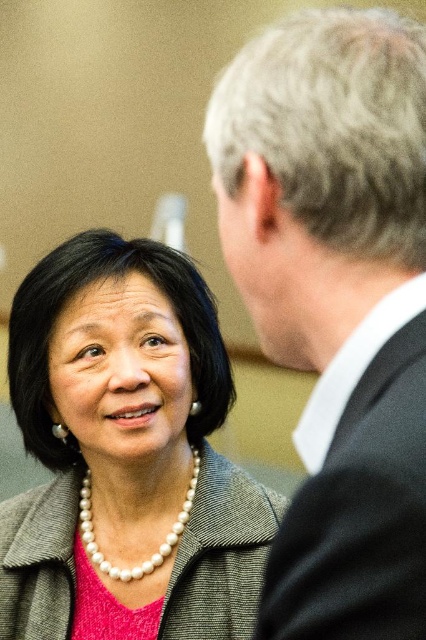
Question: Does black wool suit at upper right appear under gray textured jacket at center?

Choices:
 (A) yes
 (B) no

Answer: (B)

Question: Can you confirm if smooth gray suit at right is positioned to the left of pearl necklace at center?

Choices:
 (A) no
 (B) yes

Answer: (A)

Question: Which object is closer to the camera taking this photo?

Choices:
 (A) smooth gray suit at right
 (B) gray textured jacket at center
 (C) black wool suit at upper right
 (D) pearl necklace at center

Answer: (A)

Question: Which object appears closest to the camera in this image?

Choices:
 (A) black wool suit at upper right
 (B) smooth gray suit at right
 (C) gray textured jacket at center
 (D) pearl necklace at center

Answer: (B)

Question: Which point is farther from the camera taking this photo?

Choices:
 (A) (252, 60)
 (B) (210, 464)

Answer: (B)

Question: Can you confirm if smooth gray suit at right is positioned to the left of gray textured jacket at center?

Choices:
 (A) no
 (B) yes

Answer: (A)